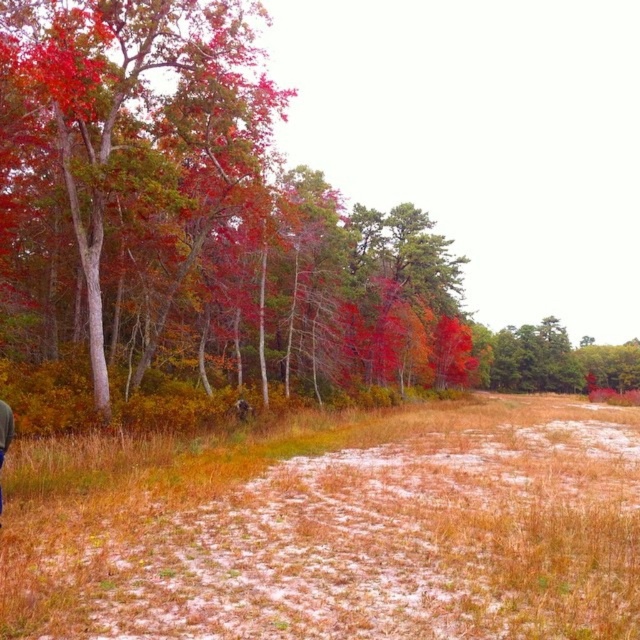
Question: Which of the following is the farthest from the observer?

Choices:
 (A) brown grass at center
 (B) denim jacket at lower left

Answer: (B)

Question: Among these objects, which one is farthest from the camera?

Choices:
 (A) denim jacket at lower left
 (B) autumn leaves at left
 (C) brown grass at center

Answer: (B)

Question: Does autumn leaves at left appear over brown grass at center?

Choices:
 (A) no
 (B) yes

Answer: (B)

Question: Which of the following is the farthest from the observer?

Choices:
 (A) denim jacket at lower left
 (B) autumn leaves at left
 (C) brown grass at center

Answer: (B)

Question: Can you confirm if autumn leaves at left is smaller than brown grass at center?

Choices:
 (A) no
 (B) yes

Answer: (A)

Question: Is the position of autumn leaves at left more distant than that of brown grass at center?

Choices:
 (A) no
 (B) yes

Answer: (B)